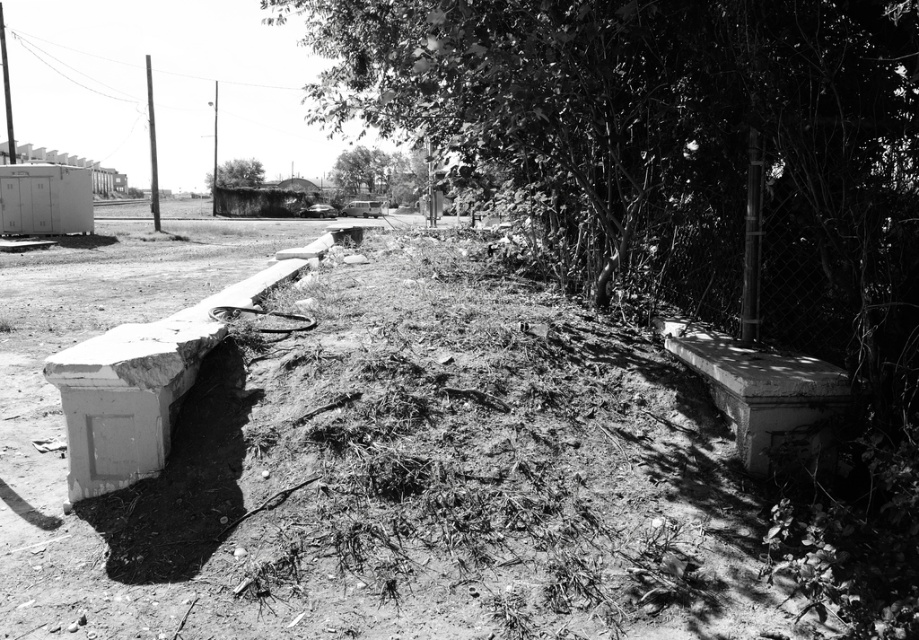
This screenshot has height=640, width=919. Describe the element at coordinates (373, 460) in the screenshot. I see `dirt field at center` at that location.

Is point (747, 632) more distant than point (381, 179)?

No, (747, 632) is in front of (381, 179).

Is point (339, 376) positioned in front of point (338, 168)?

Yes, it is in front of point (338, 168).

Locate an element on the screen. The width and height of the screenshot is (919, 640). dirt field at center is located at coordinates (373, 460).

Find the location of a particular element. smooth green tree at upper center is located at coordinates (361, 172).

Who is lower down, smooth green tree at upper center or green leafy tree at upper center?

green leafy tree at upper center

Is point (384, 186) more distant than point (256, 186)?

No, it is in front of (256, 186).

You are a GUI agent. You are given a task and a screenshot of the screen. Output one action in this format:
    pyautogui.click(x=<x>, y=<y>)
    Task: Click on the smooth green tree at upper center
    The image size is (919, 640).
    Given the screenshot: What is the action you would take?
    pyautogui.click(x=361, y=172)

How far apart are dirt field at center and green leafy tree at upper center?

28.90 meters

Which is more to the right, dirt field at center or green leafy tree at upper center?

Positioned to the right is dirt field at center.

Find the location of `dirt field at center`. dirt field at center is located at coordinates (373, 460).

At what (x,y) coordinates should I click in order to perform the action: click on dirt field at center. Please return your answer as a coordinate pair (x, y). Looking at the image, I should click on (373, 460).